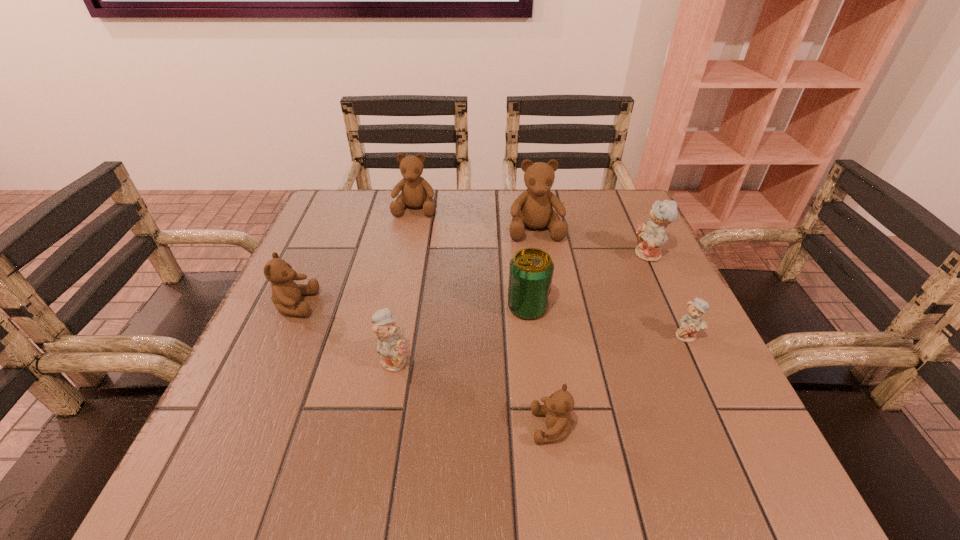
Locate an element on the screen. the second farthest blue teddy bear is located at coordinates (693, 321).

At what (x,y) coordinates should I click in order to perform the action: click on the smallest brown teddy bear. Please return your answer as a coordinate pair (x, y). Looking at the image, I should click on (557, 407).

Locate an element on the screen. This screenshot has height=540, width=960. the nearest object is located at coordinates (557, 407).

Where is `free space located on the front-facing side of the biggest brown teddy bear`? This screenshot has width=960, height=540. free space located on the front-facing side of the biggest brown teddy bear is located at coordinates (561, 381).

At what (x,y) coordinates should I click in order to perform the action: click on free space located on the front-facing side of the second brown teddy bear from left to right. Please return your answer as a coordinate pair (x, y). This screenshot has height=540, width=960. Looking at the image, I should click on (401, 274).

Where is `free location located on the front-facing side of the farthest blue teddy bear`? free location located on the front-facing side of the farthest blue teddy bear is located at coordinates (558, 255).

Locate an element on the screen. vacant space located 0.190m on the front-facing side of the farthest blue teddy bear is located at coordinates (554, 255).

Where is `vacant space located on the front-facing side of the farthest blue teddy bear`? The width and height of the screenshot is (960, 540). vacant space located on the front-facing side of the farthest blue teddy bear is located at coordinates (600, 255).

The height and width of the screenshot is (540, 960). What are the coordinates of `vacant area situated on the right of the beer can` in the screenshot? It's located at (636, 307).

Where is `free point located 0.370m on the front-facing side of the seventh farthest object`? Image resolution: width=960 pixels, height=540 pixels. free point located 0.370m on the front-facing side of the seventh farthest object is located at coordinates (610, 359).